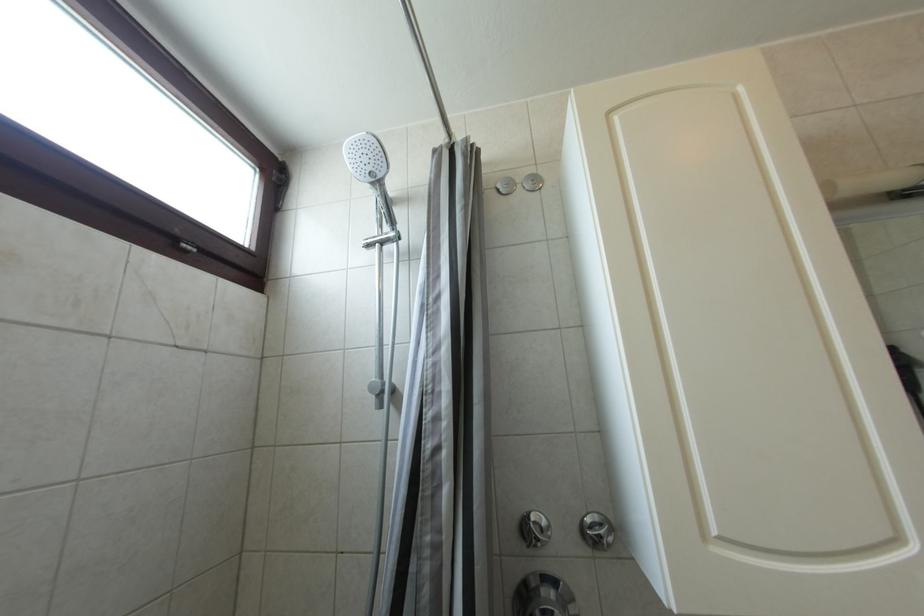
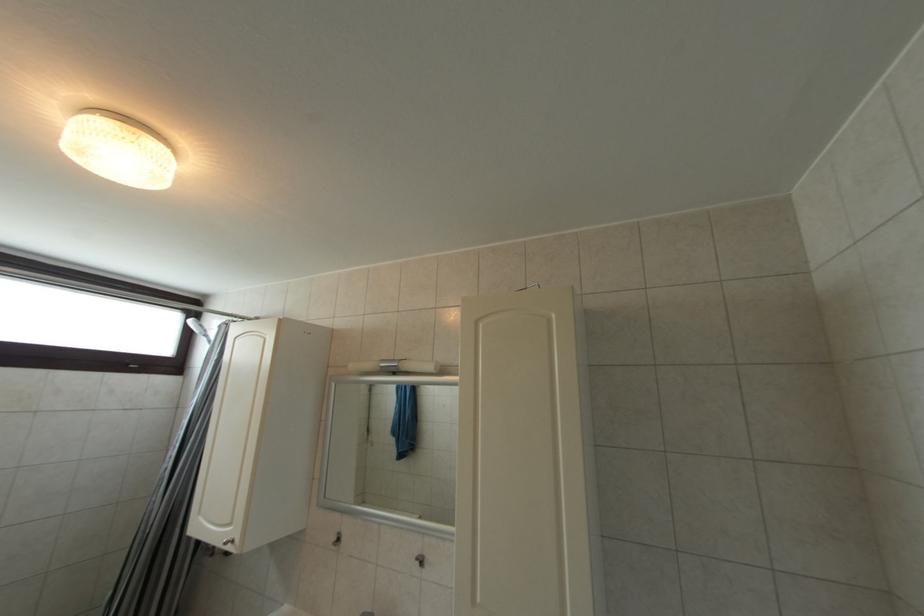
Question: What movement of the cameraman would produce the second image?

Choices:
 (A) Left
 (B) Right
 (C) Forward
 (D) Backward

Answer: (B)